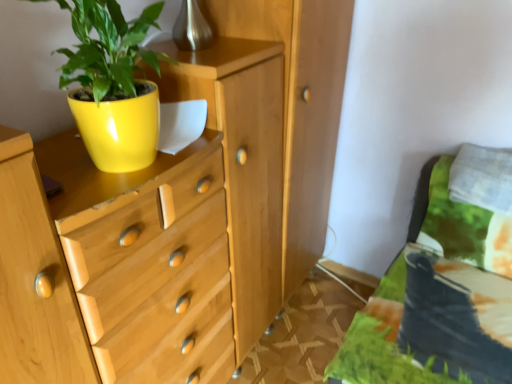
The width and height of the screenshot is (512, 384). Describe the element at coordinates (113, 84) in the screenshot. I see `matte yellow pot at upper left` at that location.

In order to click on matte wood chest of drawers at left in this screenshot , I will do `click(269, 145)`.

What is the approximate height of matte wood chest of drawers at left?

It is 1.19 meters.

This screenshot has width=512, height=384. I want to click on matte yellow pot at upper left, so click(x=113, y=84).

From the image's perspective, which is below, matte wood chest of drawers at left or yellow glossy flowerpot at upper left?

matte wood chest of drawers at left is shown below in the image.

Looking at this image, how many degrees apart are the facing directions of matte wood chest of drawers at left and yellow glossy flowerpot at upper left?

They differ by 0.474 degrees in their facing directions.

From a real-world perspective, between matte wood chest of drawers at left and yellow glossy flowerpot at upper left, who is vertically lower?

matte wood chest of drawers at left, from a real-world perspective.

Is matte wood chest of drawers at left located outside yellow glossy flowerpot at upper left?

Indeed, matte wood chest of drawers at left is completely outside yellow glossy flowerpot at upper left.

Which point is more distant from viewer, (149, 92) or (121, 75)?

Point (149, 92)

In terms of width, does yellow glossy flowerpot at upper left look wider or thinner when compared to matte yellow pot at upper left?

In the image, yellow glossy flowerpot at upper left appears to be wider than matte yellow pot at upper left.

Who is shorter, yellow glossy flowerpot at upper left or matte yellow pot at upper left?

With less height is yellow glossy flowerpot at upper left.

Is yellow glossy flowerpot at upper left turned away from matte yellow pot at upper left?

yellow glossy flowerpot at upper left does not have its back to matte yellow pot at upper left.

Is yellow glossy flowerpot at upper left at the left side of white soft pillow at upper right?

Yes.

Locate an element on the screen. flowerpot that appears above the white soft pillow at upper right (from the image's perspective) is located at coordinates (119, 128).

Are yellow glossy flowerpot at upper left and white soft pillow at upper right far apart?

Yes, yellow glossy flowerpot at upper left is far from white soft pillow at upper right.

Which is in front, yellow glossy flowerpot at upper left or white soft pillow at upper right?

yellow glossy flowerpot at upper left is closer to the camera.

Is white soft pillow at upper right oriented away from yellow glossy flowerpot at upper left?

white soft pillow at upper right is not turned away from yellow glossy flowerpot at upper left.

Based on the photo, which is more to the right, white soft pillow at upper right or yellow glossy flowerpot at upper left?

Positioned to the right is white soft pillow at upper right.

Which is correct: white soft pillow at upper right is inside yellow glossy flowerpot at upper left, or outside of it?

white soft pillow at upper right is not inside yellow glossy flowerpot at upper left, it's outside.

What are the coordinates of `flowerpot that is above the white soft pillow at upper right (from a real-world perspective)` in the screenshot? It's located at (119, 128).

From the image's perspective, which object appears higher, white soft pillow at upper right or matte yellow pot at upper left?

matte yellow pot at upper left is shown above in the image.

Considering the sizes of objects white soft pillow at upper right and matte yellow pot at upper left in the image provided, who is shorter, white soft pillow at upper right or matte yellow pot at upper left?

Standing shorter between the two is white soft pillow at upper right.

Would you consider white soft pillow at upper right to be distant from matte yellow pot at upper left?

Indeed, white soft pillow at upper right is not near matte yellow pot at upper left.

Based on the photo, can matte yellow pot at upper left be found inside matte wood chest of drawers at left?

Yes, matte yellow pot at upper left is inside matte wood chest of drawers at left.

Does matte wood chest of drawers at left have a smaller size compared to matte yellow pot at upper left?

Actually, matte wood chest of drawers at left might be larger than matte yellow pot at upper left.

The width and height of the screenshot is (512, 384). Find the location of `chest of drawers below the matte yellow pot at upper left (from a real-world perspective)`. chest of drawers below the matte yellow pot at upper left (from a real-world perspective) is located at coordinates (269, 145).

Is matte wood chest of drawers at left directly adjacent to matte yellow pot at upper left?

No.

Is white soft pillow at upper right facing away from matte wood chest of drawers at left?

That's not correct — white soft pillow at upper right is not looking away from matte wood chest of drawers at left.

Is white soft pillow at upper right not near matte wood chest of drawers at left?

Actually, white soft pillow at upper right and matte wood chest of drawers at left are a little close together.

Locate an element on the screen. This screenshot has height=384, width=512. flowerpot that is on the right side of matte wood chest of drawers at left is located at coordinates (119, 128).

I want to click on flowerpot above the matte yellow pot at upper left (from the image's perspective), so click(119, 128).

Considering their positions, is matte wood chest of drawers at left positioned further to matte yellow pot at upper left than white soft pillow at upper right?

Based on the image, white soft pillow at upper right appears to be further to matte yellow pot at upper left.

When comparing their distances from yellow glossy flowerpot at upper left, does matte wood chest of drawers at left or white soft pillow at upper right seem closer?

matte wood chest of drawers at left.

Looking at the image, which one is located further to yellow glossy flowerpot at upper left, matte yellow pot at upper left or matte wood chest of drawers at left?

matte wood chest of drawers at left lies further to yellow glossy flowerpot at upper left than the other object.

From the image, which object appears to be farther from white soft pillow at upper right, matte yellow pot at upper left or yellow glossy flowerpot at upper left?

matte yellow pot at upper left is positioned further to the anchor white soft pillow at upper right.

Considering their positions, is yellow glossy flowerpot at upper left positioned further to white soft pillow at upper right than matte yellow pot at upper left?

Based on the image, matte yellow pot at upper left appears to be further to white soft pillow at upper right.

When comparing their distances from matte yellow pot at upper left, does matte wood chest of drawers at left or yellow glossy flowerpot at upper left seem closer?

yellow glossy flowerpot at upper left lies closer to matte yellow pot at upper left than the other object.

When comparing their distances from yellow glossy flowerpot at upper left, does matte yellow pot at upper left or white soft pillow at upper right seem closer?

matte yellow pot at upper left lies closer to yellow glossy flowerpot at upper left than the other object.

Considering their positions, is white soft pillow at upper right positioned further to matte wood chest of drawers at left than matte yellow pot at upper left?

white soft pillow at upper right is further to matte wood chest of drawers at left.

You are a GUI agent. You are given a task and a screenshot of the screen. Output one action in this format:
    pyautogui.click(x=<x>, y=<y>)
    Task: Click on the houseplant located between matte wood chest of drawers at left and white soft pillow at upper right in the left-right direction
    Image resolution: width=512 pixels, height=384 pixels.
    Given the screenshot: What is the action you would take?
    pyautogui.click(x=113, y=84)

The image size is (512, 384). Find the location of `houseplant between yellow glossy flowerpot at upper left and matte wood chest of drawers at left from top to bottom`. houseplant between yellow glossy flowerpot at upper left and matte wood chest of drawers at left from top to bottom is located at coordinates (113, 84).

Locate an element on the screen. The image size is (512, 384). flowerpot between matte yellow pot at upper left and white soft pillow at upper right from left to right is located at coordinates pyautogui.click(x=119, y=128).

At what (x,y) coordinates should I click in order to perform the action: click on flowerpot between matte wood chest of drawers at left and white soft pillow at upper right in the horizontal direction. Please return your answer as a coordinate pair (x, y). Looking at the image, I should click on (119, 128).